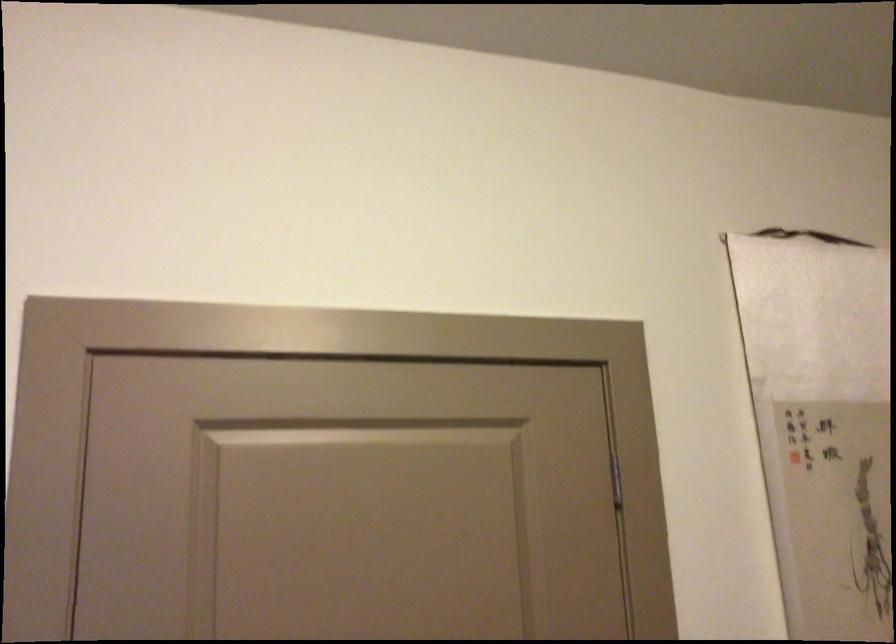
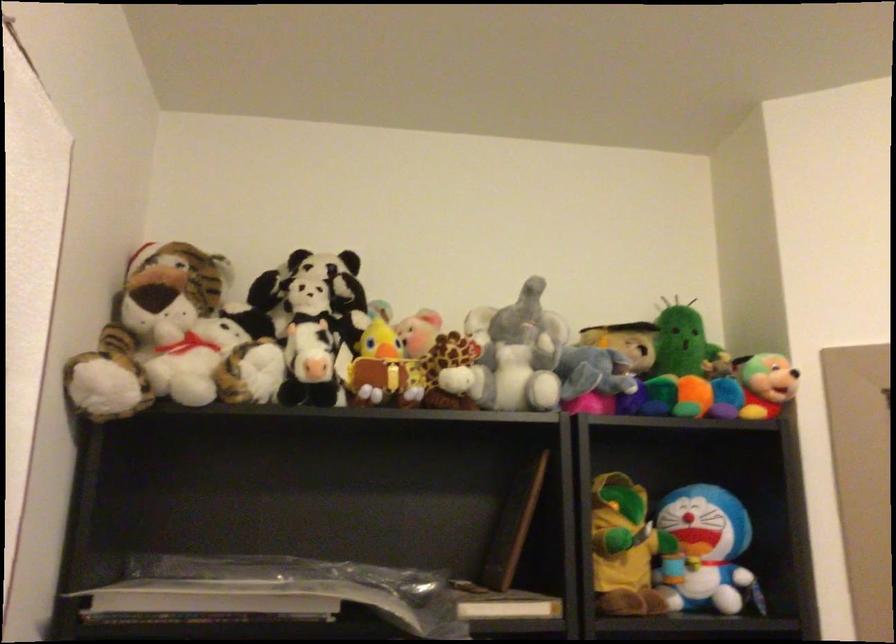
Based on the continuous images, in which direction is the camera rotating?

The camera's rotation is toward right-up.